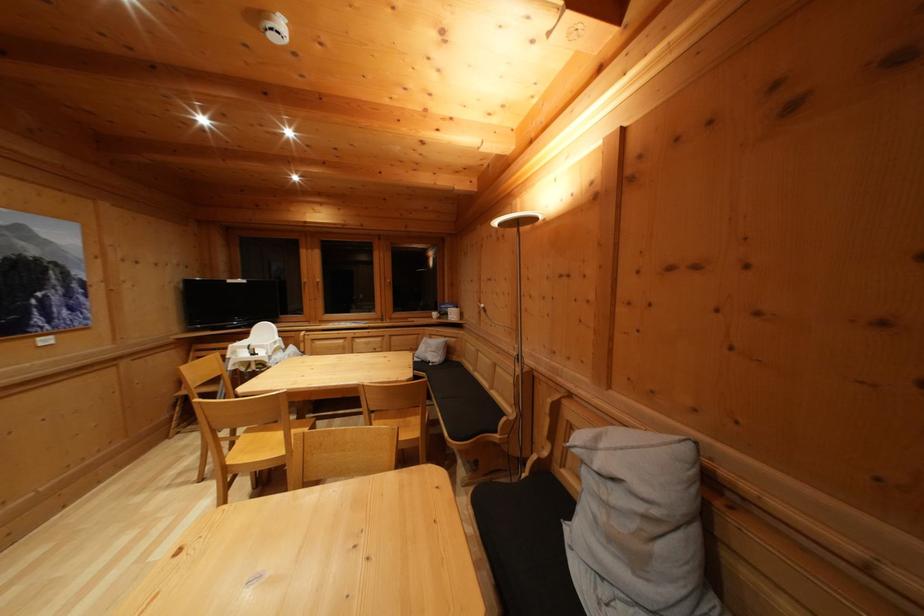
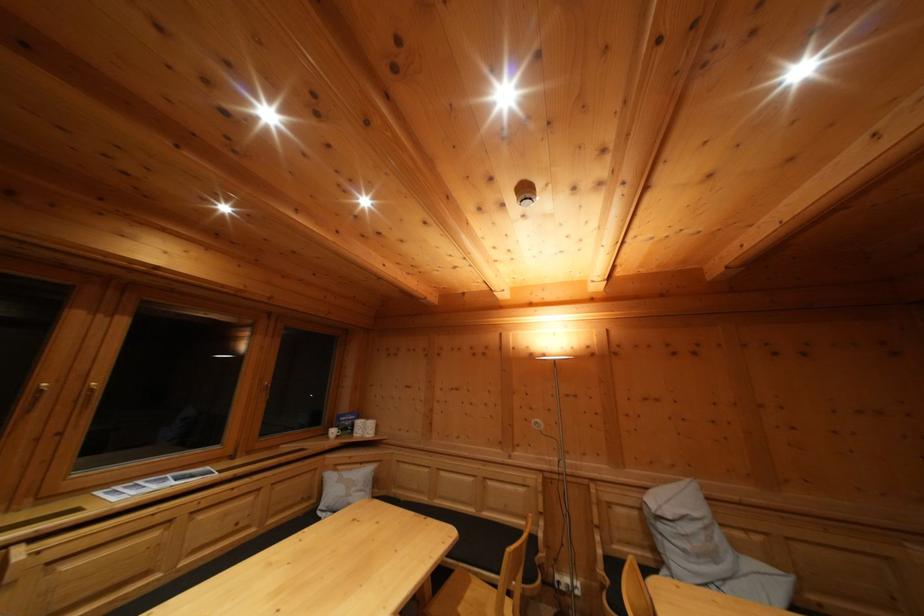
In the second image, find the point that corresponds to pixel 451 344 in the first image.

(368, 469)